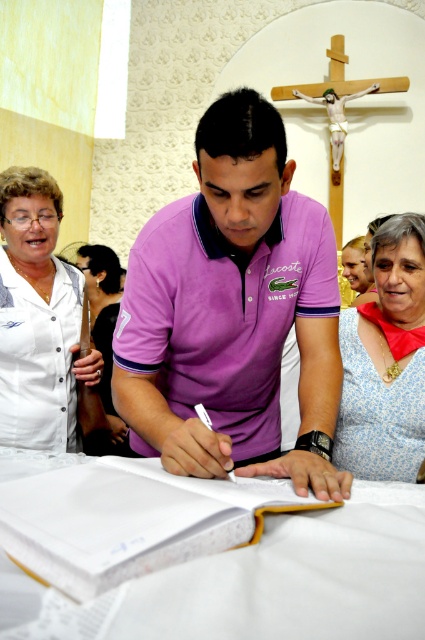
Question: Among these objects, which one is nearest to the camera?

Choices:
 (A) blue floral dress at lower right
 (B) dark brown leather purse at left
 (C) white button-up shirt at upper left
 (D) white paper book at center

Answer: (D)

Question: Does blue floral dress at lower right have a greater width compared to dark brown leather purse at left?

Choices:
 (A) yes
 (B) no

Answer: (B)

Question: Can you confirm if white button-up shirt at upper left is positioned above blue floral dress at lower right?

Choices:
 (A) yes
 (B) no

Answer: (A)

Question: Which point is farther to the camera?

Choices:
 (A) dark brown leather purse at left
 (B) purple cotton polo shirt at center
 (C) white button-up shirt at upper left
 (D) white paper book at center

Answer: (A)

Question: Is blue floral dress at lower right thinner than dark brown leather purse at left?

Choices:
 (A) no
 (B) yes

Answer: (B)

Question: Which of these objects is positioned closest to the purple cotton polo shirt at center?

Choices:
 (A) white paper book at center
 (B) white button-up shirt at upper left
 (C) blue floral dress at lower right

Answer: (A)